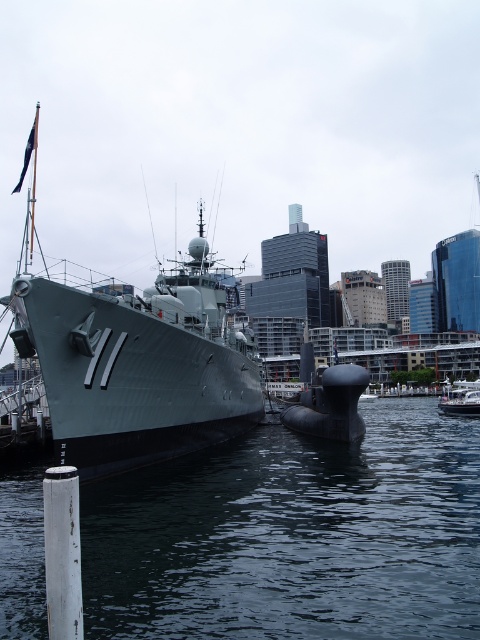
You are a sailor on the matte gray ship at center. You need to lower a lifeboat into the water. Which direction should you move the lifeboat to get it into the dark blue water at lower center?

The dark blue water at lower center is located below the matte gray ship at center, so you should lower the lifeboat downward towards the dark blue water at lower center.

You are standing on the dock and see the dark blue water at lower center and the matte gray ship at center. Which object is nearer to you?

The dark blue water at lower center is closer to the viewer than the matte gray ship at center.

You are a photographer planning to capture the white glossy boat at lower right and the dark blue water at lower center in a single shot. Which object will occupy more of the frame?

The dark blue water at lower center will occupy more of the frame since it is larger in size than the white glossy boat at lower right according to the description.